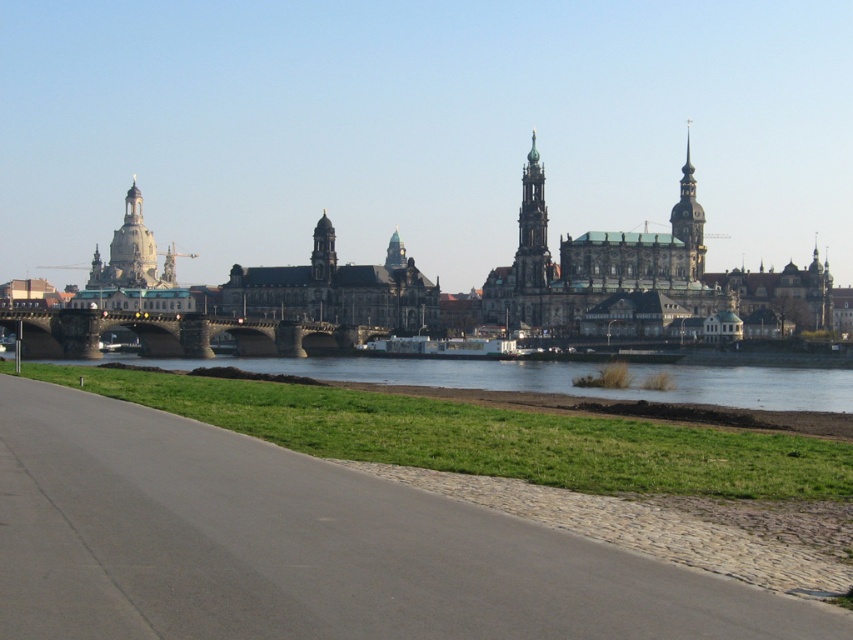
You are an architect visiting Dresden and want to take a photo of both the smooth gold spire at center right and the golden stone tower at center. Based on their positions, which one should you focus on first to ensure both are in the frame?

You should focus on the golden stone tower at center first since the smooth gold spire at center right is to the right of it, so by centering the golden stone tower, the spire will naturally be included in the frame to its right.

You are standing on the paved pathway in front of the Frauenkirche and want to take a photo of the smooth gold spire at center right. If your camera has a maximum zoom range of 100 meters, will you be able to capture the spire clearly?

The smooth gold spire at center right is 152.68 meters away from the viewer. Since the camera can only zoom up to 100 meters, it won cannot capture the spire clearly at that distance.